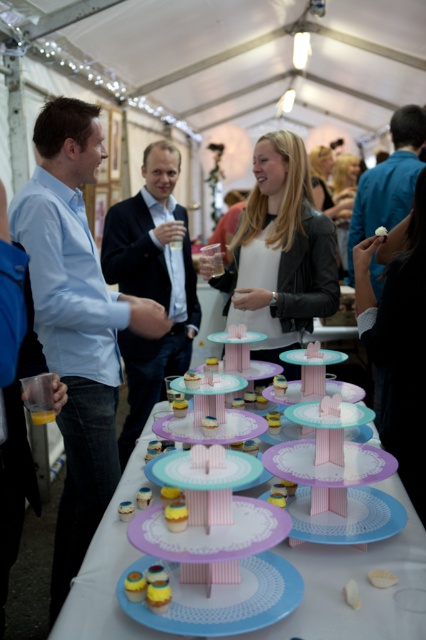
Where is `dark blue suit at center`? The height and width of the screenshot is (640, 426). dark blue suit at center is located at coordinates (152, 282).

Is dark blue suit at center taller than pink paper cupcake at center?

Yes, dark blue suit at center is taller than pink paper cupcake at center.

The height and width of the screenshot is (640, 426). Identify the location of dark blue suit at center. (152, 282).

Is pink paper plate at center in front of pink paper cupcake at center?

No, it is not.

The image size is (426, 640). What do you see at coordinates (210, 428) in the screenshot? I see `pink paper plate at center` at bounding box center [210, 428].

Locate an element on the screen. The width and height of the screenshot is (426, 640). pink paper plate at center is located at coordinates (210, 428).

Is point (37, 259) closer to viewer compared to point (227, 612)?

No, (37, 259) is further to viewer.

Is the position of blue shirt at left more distant than that of blue paper plate at center?

Yes, it is behind blue paper plate at center.

The height and width of the screenshot is (640, 426). I want to click on blue shirt at left, so click(77, 321).